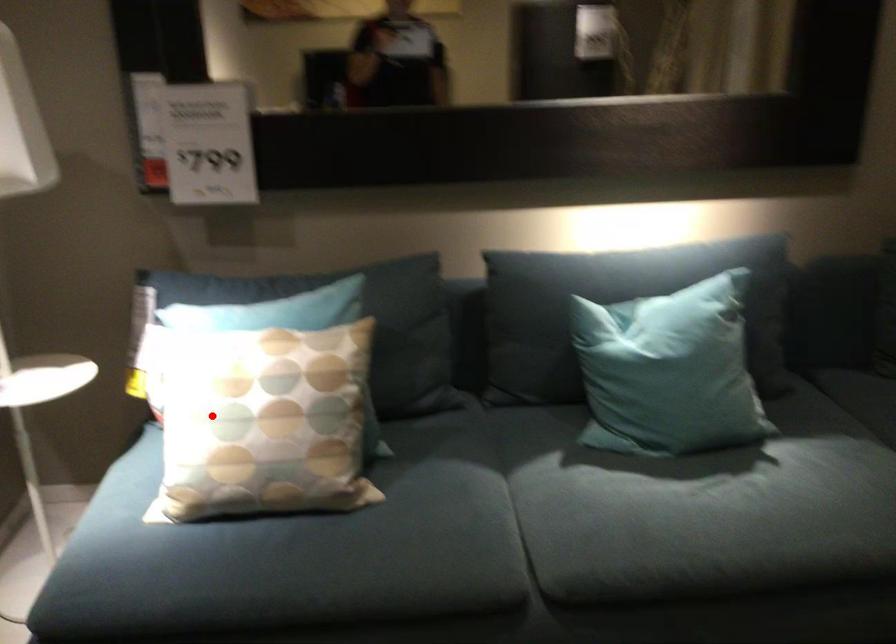
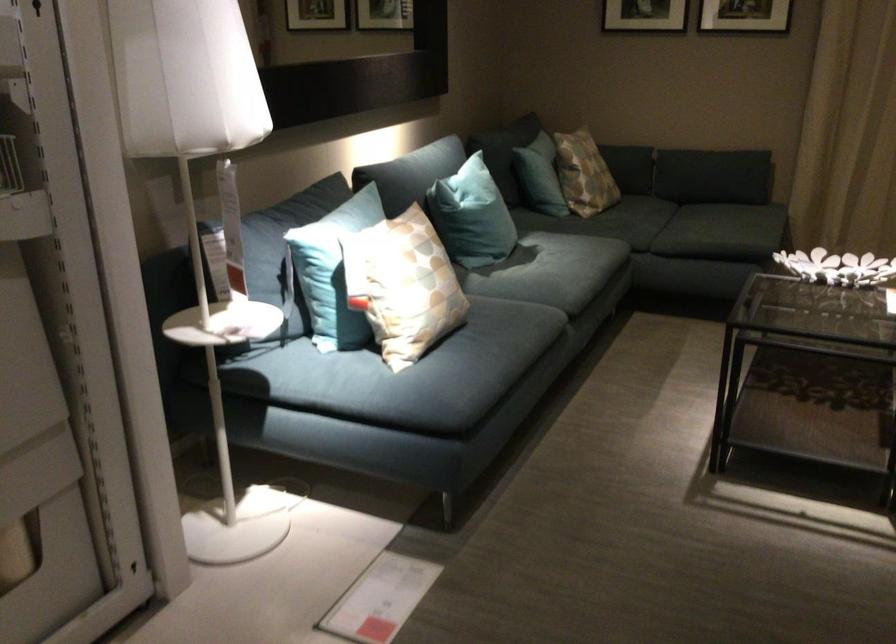
Question: I am providing you with two images of the same scene from different viewpoints. A red point is shown in image1. For the corresponding object point in image2, is it positioned nearer or farther from the camera?

Choices:
 (A) Nearer
 (B) Farther

Answer: (B)